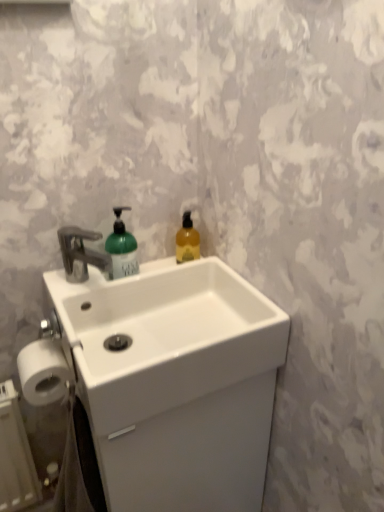
This screenshot has height=512, width=384. I want to click on green matte bottle at center, arranged as the 2th bottle when viewed from the right, so click(x=122, y=248).

Locate an element on the screen. white matte toilet paper at lower left is located at coordinates (43, 371).

This screenshot has height=512, width=384. Find the location of `white ceramic sink at center`. white ceramic sink at center is located at coordinates (160, 332).

Does white ceramic sink at center have a greater height compared to translucent amber liquid at upper right, acting as the 2th bottle starting from the left?

Indeed, white ceramic sink at center has a greater height compared to translucent amber liquid at upper right, acting as the 2th bottle starting from the left.

From the picture: Are white ceramic sink at center and translucent amber liquid at upper right, the first bottle in the right-to-left sequence, located far from each other?

white ceramic sink at center is actually quite close to translucent amber liquid at upper right, the first bottle in the right-to-left sequence.

Where is `sink in front of the translucent amber liquid at upper right, the first bottle in the right-to-left sequence`? The image size is (384, 512). sink in front of the translucent amber liquid at upper right, the first bottle in the right-to-left sequence is located at coordinates (160, 332).

Can you confirm if white ceramic sink at center is smaller than green matte bottle at center, arranged as the 2th bottle when viewed from the right?

No, white ceramic sink at center is not smaller than green matte bottle at center, arranged as the 2th bottle when viewed from the right.

How many degrees apart are the facing directions of white ceramic sink at center and green matte bottle at center, arranged as the 2th bottle when viewed from the right?

0.00306 degrees.

Does white ceramic sink at center appear on the left side of green matte bottle at center, the first bottle viewed from the left?

Incorrect, white ceramic sink at center is not on the left side of green matte bottle at center, the first bottle viewed from the left.

Can you confirm if white ceramic sink at center is taller than green matte bottle at center, the first bottle viewed from the left?

Yes, white ceramic sink at center is taller than green matte bottle at center, the first bottle viewed from the left.

Which is more to the left, translucent amber liquid at upper right, the first bottle in the right-to-left sequence, or white ceramic sink at center?

Positioned to the left is white ceramic sink at center.

From the picture: Can you tell me how much translucent amber liquid at upper right, acting as the 2th bottle starting from the left, and white ceramic sink at center differ in facing direction?

They differ by 0.00208 degrees in their facing directions.

Is translucent amber liquid at upper right, acting as the 2th bottle starting from the left, next to white ceramic sink at center?

No, translucent amber liquid at upper right, acting as the 2th bottle starting from the left, is not touching white ceramic sink at center.

Does translucent amber liquid at upper right, acting as the 2th bottle starting from the left, have a greater width compared to white ceramic sink at center?

In fact, translucent amber liquid at upper right, acting as the 2th bottle starting from the left, might be narrower than white ceramic sink at center.

Is point (42, 349) closer to camera compared to point (253, 359)?

No, it is behind (253, 359).

Would you say white matte toilet paper at lower left contains white ceramic sink at center?

No, white matte toilet paper at lower left does not contain white ceramic sink at center.

From a real-world perspective, is white matte toilet paper at lower left physically below white ceramic sink at center?

Correct, in the physical world, white matte toilet paper at lower left is lower than white ceramic sink at center.

Which is more to the right, white matte toilet paper at lower left or white ceramic sink at center?

white ceramic sink at center is more to the right.

From the image's perspective, would you say green matte bottle at center, the first bottle viewed from the left, is positioned over translucent amber liquid at upper right, acting as the 2th bottle starting from the left?

No, from the image's perspective, green matte bottle at center, the first bottle viewed from the left, is not above translucent amber liquid at upper right, acting as the 2th bottle starting from the left.

Considering the relative positions of green matte bottle at center, the first bottle viewed from the left, and translucent amber liquid at upper right, acting as the 2th bottle starting from the left, in the image provided, is green matte bottle at center, the first bottle viewed from the left, to the left of translucent amber liquid at upper right, acting as the 2th bottle starting from the left, from the viewer's perspective?

Yes, green matte bottle at center, the first bottle viewed from the left, is to the left of translucent amber liquid at upper right, acting as the 2th bottle starting from the left.

Could you tell me if green matte bottle at center, the first bottle viewed from the left, is facing translucent amber liquid at upper right, acting as the 2th bottle starting from the left?

No, green matte bottle at center, the first bottle viewed from the left, is not facing towards translucent amber liquid at upper right, acting as the 2th bottle starting from the left.

Is green matte bottle at center, the first bottle viewed from the left, placed right next to translucent amber liquid at upper right, the first bottle in the right-to-left sequence?

They are not placed beside each other.

Is green matte bottle at center, arranged as the 2th bottle when viewed from the right, facing towards white ceramic sink at center?

Yes, green matte bottle at center, arranged as the 2th bottle when viewed from the right, faces towards white ceramic sink at center.

Is green matte bottle at center, arranged as the 2th bottle when viewed from the right, spatially inside white ceramic sink at center, or outside of it?

green matte bottle at center, arranged as the 2th bottle when viewed from the right, is spatially situated outside white ceramic sink at center.

You are a GUI agent. You are given a task and a screenshot of the screen. Output one action in this format:
    pyautogui.click(x=<x>, y=<y>)
    Task: Click on the sink below the green matte bottle at center, the first bottle viewed from the left (from a real-world perspective)
    
    Given the screenshot: What is the action you would take?
    pyautogui.click(x=160, y=332)

From the image's perspective, is green matte bottle at center, the first bottle viewed from the left, located beneath white ceramic sink at center?

Incorrect, from the image's perspective, green matte bottle at center, the first bottle viewed from the left, is higher than white ceramic sink at center.

Who is bigger, translucent amber liquid at upper right, the first bottle in the right-to-left sequence, or green matte bottle at center, arranged as the 2th bottle when viewed from the right?

green matte bottle at center, arranged as the 2th bottle when viewed from the right.

Can you confirm if translucent amber liquid at upper right, the first bottle in the right-to-left sequence, is shorter than green matte bottle at center, the first bottle viewed from the left?

Correct, translucent amber liquid at upper right, the first bottle in the right-to-left sequence, is not as tall as green matte bottle at center, the first bottle viewed from the left.

Is translucent amber liquid at upper right, acting as the 2th bottle starting from the left, positioned far away from green matte bottle at center, arranged as the 2th bottle when viewed from the right?

That's not correct — translucent amber liquid at upper right, acting as the 2th bottle starting from the left, is a little close to green matte bottle at center, arranged as the 2th bottle when viewed from the right.

Would you say green matte bottle at center, arranged as the 2th bottle when viewed from the right, is part of translucent amber liquid at upper right, acting as the 2th bottle starting from the left,'s contents?

Actually, green matte bottle at center, arranged as the 2th bottle when viewed from the right, is outside translucent amber liquid at upper right, acting as the 2th bottle starting from the left.

Find the location of `the 2nd bottle above the white ceramic sink at center (from the image's perspective)`. the 2nd bottle above the white ceramic sink at center (from the image's perspective) is located at coordinates (187, 241).

I want to click on sink that is under the green matte bottle at center, arranged as the 2th bottle when viewed from the right (from a real-world perspective), so click(160, 332).

When comparing their distances from white matte toilet paper at lower left, does translucent amber liquid at upper right, acting as the 2th bottle starting from the left, or white ceramic sink at center seem further?

translucent amber liquid at upper right, acting as the 2th bottle starting from the left, is further to white matte toilet paper at lower left.

Which object lies further to the anchor point green matte bottle at center, arranged as the 2th bottle when viewed from the right, white matte toilet paper at lower left or white ceramic sink at center?

Among the two, white matte toilet paper at lower left is located further to green matte bottle at center, arranged as the 2th bottle when viewed from the right.

From the image, which object appears to be farther from white ceramic sink at center, white matte toilet paper at lower left or translucent amber liquid at upper right, the first bottle in the right-to-left sequence?

translucent amber liquid at upper right, the first bottle in the right-to-left sequence, is further to white ceramic sink at center.

Looking at the image, which one is located further to green matte bottle at center, the first bottle viewed from the left, translucent amber liquid at upper right, the first bottle in the right-to-left sequence, or white ceramic sink at center?

white ceramic sink at center lies further to green matte bottle at center, the first bottle viewed from the left, than the other object.

Looking at the image, which one is located closer to white matte toilet paper at lower left, green matte bottle at center, the first bottle viewed from the left, or white ceramic sink at center?

white ceramic sink at center is positioned closer to the anchor white matte toilet paper at lower left.

Based on their spatial positions, is green matte bottle at center, the first bottle viewed from the left, or translucent amber liquid at upper right, acting as the 2th bottle starting from the left, closer to white ceramic sink at center?

Based on the image, green matte bottle at center, the first bottle viewed from the left, appears to be nearer to white ceramic sink at center.

Looking at the image, which one is located closer to green matte bottle at center, arranged as the 2th bottle when viewed from the right, white ceramic sink at center or translucent amber liquid at upper right, the first bottle in the right-to-left sequence?

translucent amber liquid at upper right, the first bottle in the right-to-left sequence, is positioned closer to the anchor green matte bottle at center, arranged as the 2th bottle when viewed from the right.

Estimate the real-world distances between objects in this image. Which object is further from translucent amber liquid at upper right, acting as the 2th bottle starting from the left, white ceramic sink at center or white matte toilet paper at lower left?

white matte toilet paper at lower left is further to translucent amber liquid at upper right, acting as the 2th bottle starting from the left.

This screenshot has width=384, height=512. I want to click on bottle that lies between translucent amber liquid at upper right, the first bottle in the right-to-left sequence, and white matte toilet paper at lower left from top to bottom, so click(x=122, y=248).

The height and width of the screenshot is (512, 384). I want to click on toilet paper between white ceramic sink at center and translucent amber liquid at upper right, the first bottle in the right-to-left sequence, from front to back, so (x=43, y=371).

What are the coordinates of `toilet paper between white ceramic sink at center and green matte bottle at center, the first bottle viewed from the left, in the front-back direction` in the screenshot? It's located at [43, 371].

Where is `bottle positioned between white ceramic sink at center and translucent amber liquid at upper right, acting as the 2th bottle starting from the left, from near to far`? bottle positioned between white ceramic sink at center and translucent amber liquid at upper right, acting as the 2th bottle starting from the left, from near to far is located at coordinates (122, 248).